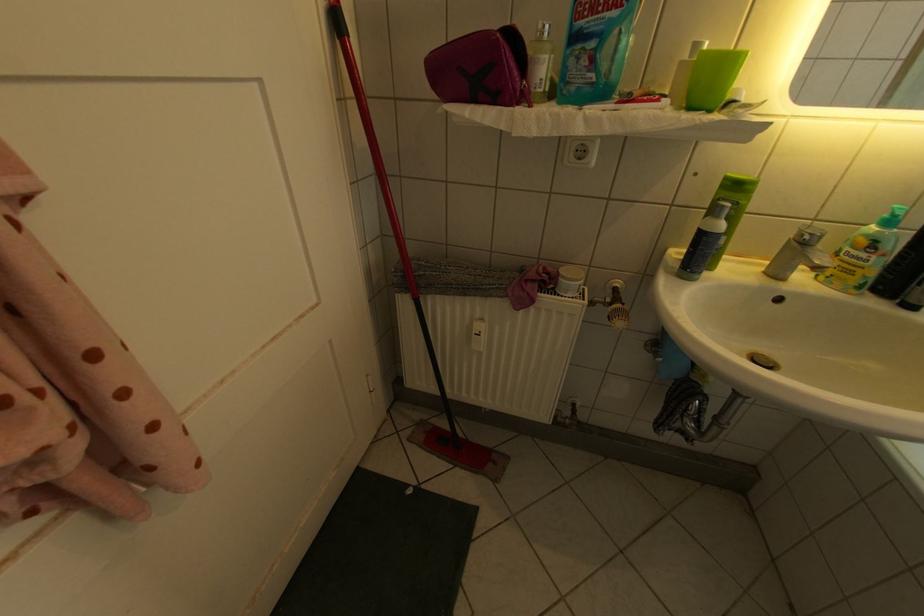
You are a GUI agent. You are given a task and a screenshot of the screen. Output one action in this format:
    pyautogui.click(x=<x>, y=<y>)
    Task: Click on the soap pump dispenser
    
    Given the screenshot: What is the action you would take?
    684,74